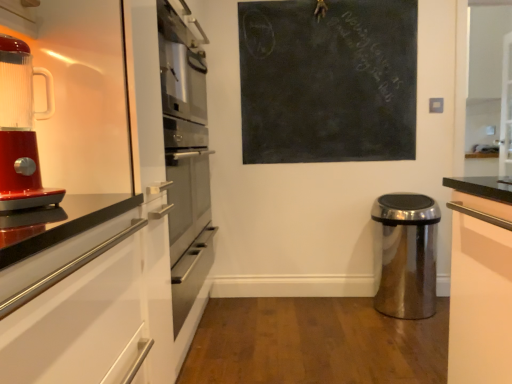
Where is `blank space situated above black chalkboard at upper center (from a real-world perspective)`? blank space situated above black chalkboard at upper center (from a real-world perspective) is located at coordinates (324, 2).